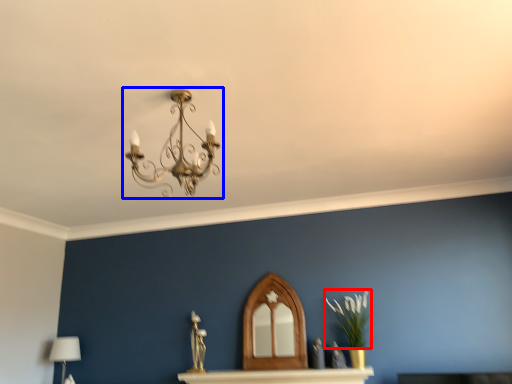
Question: Which object appears farthest to the camera in this image, plant (highlighted by a red box) or lamp (highlighted by a blue box)?

Choices:
 (A) plant
 (B) lamp

Answer: (A)